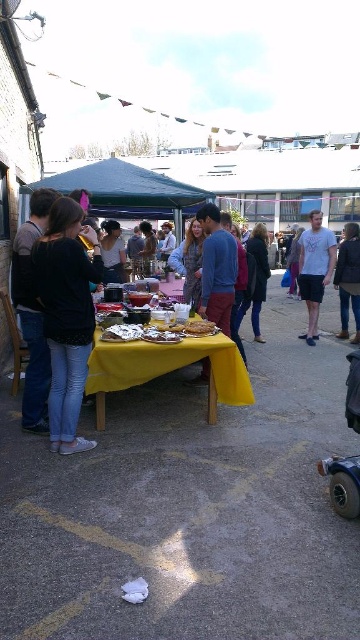
You are planning to place the dark blue coat at center and the matte brown bread at center on a shelf. Which object should you place first if you want to ensure both fit side by side?

The dark blue coat at center has a lesser width compared to matte brown bread at center, so you should place the matte brown bread at center first to accommodate its larger width before placing the dark blue coat at center.

You are organizing a small event and need to place the dark blue coat at center and the matte brown bread at center on a table. Which item should you place first to ensure both fit comfortably?

You should place the dark blue coat at center first since it occupies less space than the matte brown bread at center, allowing more room for arranging the bread comfortably.